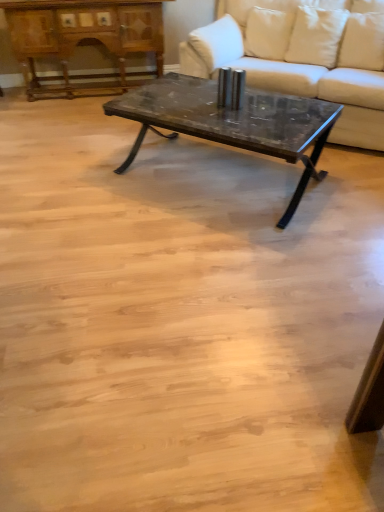
Question: Can you confirm if white fabric pillow at upper right, the first pillow when ordered from left to right, is bigger than dark gray stone coffee table at center?

Choices:
 (A) no
 (B) yes

Answer: (A)

Question: Considering the relative positions of white fabric pillow at upper right, the first pillow when ordered from left to right, and dark gray stone coffee table at center in the image provided, is white fabric pillow at upper right, the first pillow when ordered from left to right, to the left of dark gray stone coffee table at center from the viewer's perspective?

Choices:
 (A) yes
 (B) no

Answer: (B)

Question: From the image's perspective, is white fabric pillow at upper right, the first pillow when ordered from left to right, on top of dark gray stone coffee table at center?

Choices:
 (A) no
 (B) yes

Answer: (B)

Question: Is white fabric pillow at upper right, the first pillow when ordered from left to right, beside dark gray stone coffee table at center?

Choices:
 (A) no
 (B) yes

Answer: (A)

Question: Is dark gray stone coffee table at center located within white fabric pillow at upper right, the first pillow when ordered from left to right?

Choices:
 (A) no
 (B) yes

Answer: (A)

Question: Is point (132, 13) positioned closer to the camera than point (274, 3)?

Choices:
 (A) farther
 (B) closer

Answer: (A)

Question: Considering the relative positions of wooden polished dresser at upper left and white fabric couch at center in the image provided, is wooden polished dresser at upper left to the left or to the right of white fabric couch at center?

Choices:
 (A) right
 (B) left

Answer: (B)

Question: From the image's perspective, is wooden polished dresser at upper left above or below white fabric couch at center?

Choices:
 (A) below
 (B) above

Answer: (B)

Question: From a real-world perspective, is wooden polished dresser at upper left physically located above or below white fabric couch at center?

Choices:
 (A) above
 (B) below

Answer: (B)

Question: In terms of height, does dark gray stone coffee table at center look taller or shorter compared to white fabric pillow at upper right, the first pillow when ordered from left to right?

Choices:
 (A) short
 (B) tall

Answer: (B)

Question: Considering the relative positions of dark gray stone coffee table at center and white fabric pillow at upper right, the first pillow when ordered from left to right, in the image provided, is dark gray stone coffee table at center to the left or to the right of white fabric pillow at upper right, the first pillow when ordered from left to right,?

Choices:
 (A) right
 (B) left

Answer: (B)

Question: From the image's perspective, relative to white fabric pillow at upper right, marked as the second pillow in a right-to-left arrangement, is dark gray stone coffee table at center above or below?

Choices:
 (A) below
 (B) above

Answer: (A)

Question: From a real-world perspective, is dark gray stone coffee table at center positioned above or below white fabric pillow at upper right, marked as the second pillow in a right-to-left arrangement?

Choices:
 (A) above
 (B) below

Answer: (B)

Question: Is white fabric pillow at upper right, marked as the second pillow in a right-to-left arrangement, taller or shorter than dark gray stone coffee table at center?

Choices:
 (A) short
 (B) tall

Answer: (A)

Question: Considering the relative positions of white fabric pillow at upper right, marked as the second pillow in a right-to-left arrangement, and dark gray stone coffee table at center in the image provided, is white fabric pillow at upper right, marked as the second pillow in a right-to-left arrangement, to the left or to the right of dark gray stone coffee table at center?

Choices:
 (A) left
 (B) right

Answer: (B)